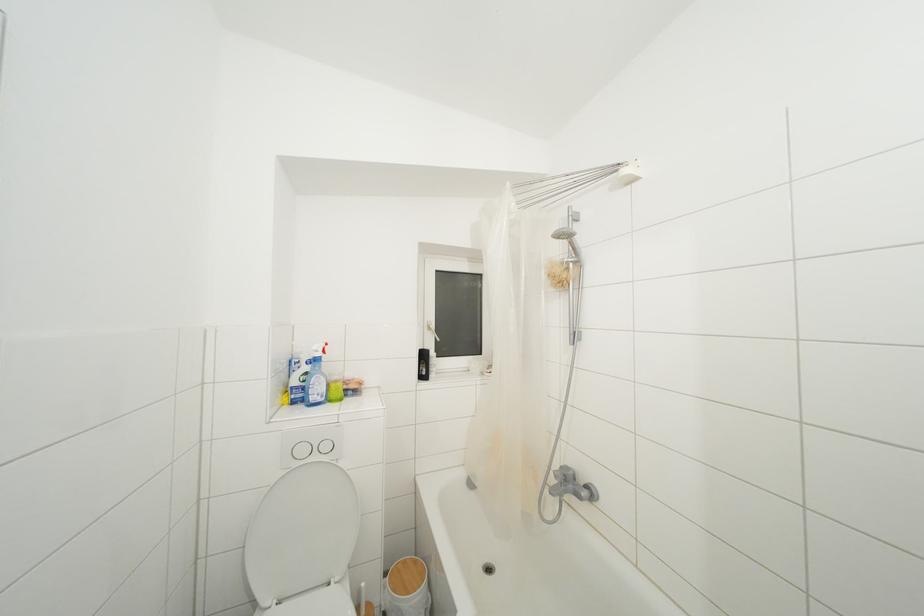
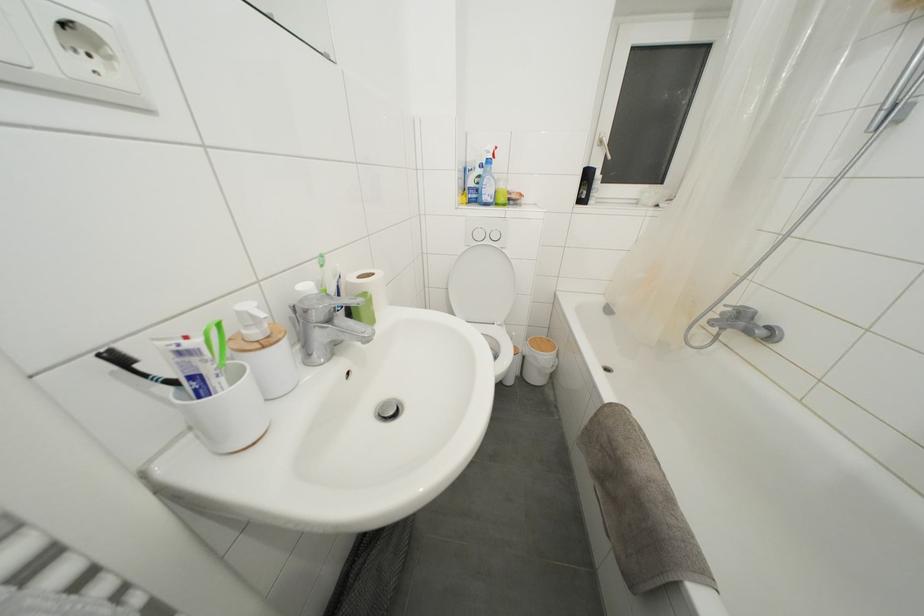
In the second image, find the point that corresponds to (560,482) in the first image.

(726, 318)